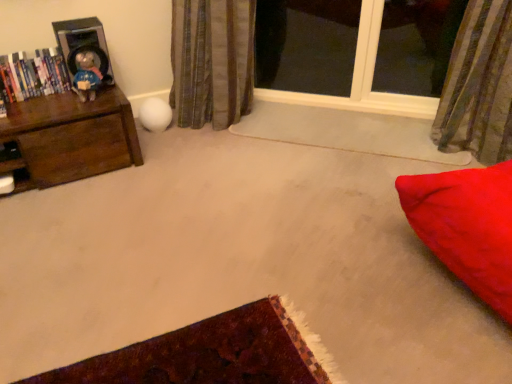
Question: Is metallic silver speaker at upper left oriented away from hardcover books at left?

Choices:
 (A) no
 (B) yes

Answer: (A)

Question: Is metallic silver speaker at upper left placed right next to hardcover books at left?

Choices:
 (A) no
 (B) yes

Answer: (A)

Question: Is metallic silver speaker at upper left located outside hardcover books at left?

Choices:
 (A) yes
 (B) no

Answer: (A)

Question: Considering the relative sizes of metallic silver speaker at upper left and hardcover books at left in the image provided, is metallic silver speaker at upper left taller than hardcover books at left?

Choices:
 (A) yes
 (B) no

Answer: (A)

Question: From a real-world perspective, is metallic silver speaker at upper left physically above hardcover books at left?

Choices:
 (A) yes
 (B) no

Answer: (A)

Question: In the image, is transparent glass window at upper center positioned in front of or behind hardcover books at left?

Choices:
 (A) front
 (B) behind

Answer: (B)

Question: In terms of height, does transparent glass window at upper center look taller or shorter compared to hardcover books at left?

Choices:
 (A) tall
 (B) short

Answer: (A)

Question: Based on their sizes in the image, would you say transparent glass window at upper center is bigger or smaller than hardcover books at left?

Choices:
 (A) big
 (B) small

Answer: (A)

Question: Is transparent glass window at upper center wider or thinner than hardcover books at left?

Choices:
 (A) wide
 (B) thin

Answer: (A)

Question: From a real-world perspective, is brown wood chest of drawers at left above or below striped fabric curtain at upper right, the 2th curtain in the left-to-right sequence?

Choices:
 (A) below
 (B) above

Answer: (A)

Question: In terms of height, does brown wood chest of drawers at left look taller or shorter compared to striped fabric curtain at upper right, the 1th curtain positioned from the right?

Choices:
 (A) short
 (B) tall

Answer: (A)

Question: Does point (83, 114) appear closer or farther from the camera than point (459, 44)?

Choices:
 (A) closer
 (B) farther

Answer: (A)

Question: Visually, is brown wood chest of drawers at left positioned to the left or to the right of striped fabric curtain at upper right, the 1th curtain positioned from the right?

Choices:
 (A) right
 (B) left

Answer: (B)

Question: Considering the positions of metallic silver speaker at upper left and brown wood chest of drawers at left in the image, is metallic silver speaker at upper left wider or thinner than brown wood chest of drawers at left?

Choices:
 (A) thin
 (B) wide

Answer: (A)

Question: In the image, is metallic silver speaker at upper left positioned in front of or behind brown wood chest of drawers at left?

Choices:
 (A) behind
 (B) front

Answer: (A)